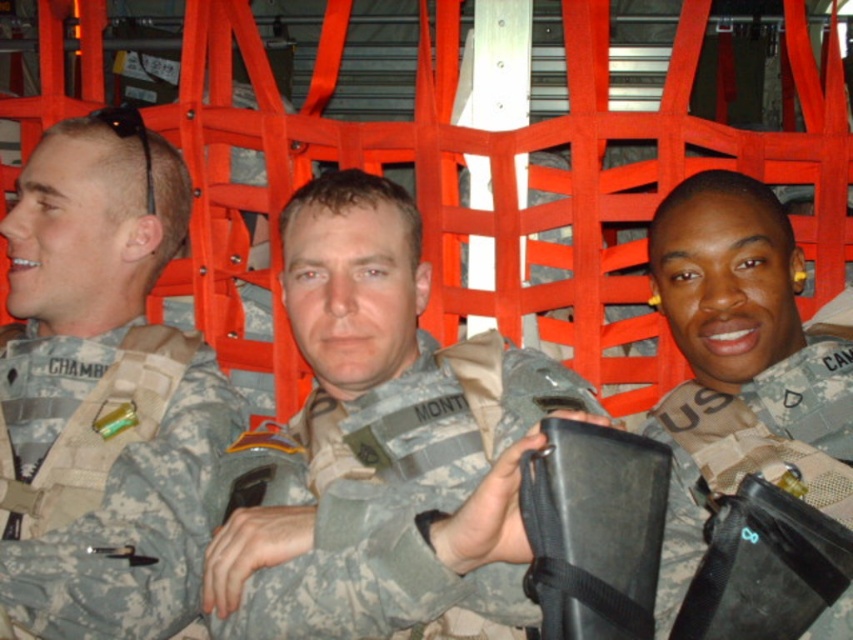
Can you confirm if camouflage fabric uniform at center is positioned to the right of camouflage fabric utility belt at center?

In fact, camouflage fabric uniform at center is to the left of camouflage fabric utility belt at center.

Does camouflage fabric uniform at center have a greater height compared to camouflage fabric utility belt at center?

Yes, camouflage fabric uniform at center is taller than camouflage fabric utility belt at center.

Where is `camouflage fabric uniform at center`? This screenshot has height=640, width=853. camouflage fabric uniform at center is located at coordinates (381, 449).

At what (x,y) coordinates should I click in order to perform the action: click on camouflage fabric uniform at center. Please return your answer as a coordinate pair (x, y). Looking at the image, I should click on (381, 449).

Which is above, camouflage fabric uniform at center or camouflage fabric uniform at left?

camouflage fabric uniform at center

Which of these two, camouflage fabric uniform at center or camouflage fabric uniform at left, stands taller?

Standing taller between the two is camouflage fabric uniform at center.

Is point (344, 273) farther from viewer compared to point (224, 433)?

No.

At what (x,y) coordinates should I click in order to perform the action: click on camouflage fabric uniform at center. Please return your answer as a coordinate pair (x, y). Looking at the image, I should click on (381, 449).

Which is behind, point (157, 378) or point (813, 481)?

The point (157, 378) is behind.

Does camouflage fabric uniform at left have a lesser width compared to camouflage fabric utility belt at center?

In fact, camouflage fabric uniform at left might be wider than camouflage fabric utility belt at center.

I want to click on camouflage fabric uniform at left, so click(99, 416).